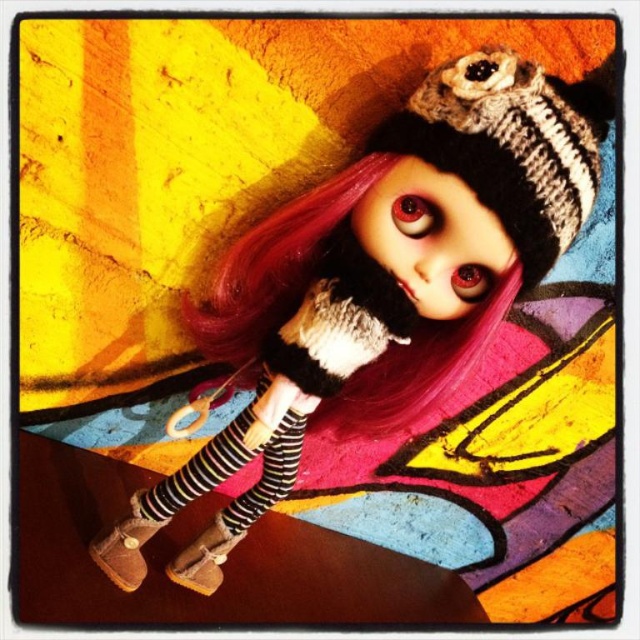
Question: Which of the following is the closest to the observer?

Choices:
 (A) tap(545, 108)
 (B) tap(401, 344)
 (C) tap(442, 344)

Answer: (A)

Question: Among these points, which one is farthest from the camera?

Choices:
 (A) pos(196,541)
 (B) pos(163,525)

Answer: (A)

Question: Can you confirm if knitted woolen beanie at upper center is positioned above brown suede boot at lower left?

Choices:
 (A) yes
 (B) no

Answer: (A)

Question: Where is suede boots at lower left located in relation to knitted woolen beanie at upper center in the image?

Choices:
 (A) below
 (B) above

Answer: (A)

Question: Does suede boots at lower left appear under suede/leather boot at lower left?

Choices:
 (A) yes
 (B) no

Answer: (B)

Question: Which is nearer to the knitted woolen beanie at upper center?

Choices:
 (A) pink matte hair at center
 (B) suede boots at lower left

Answer: (B)